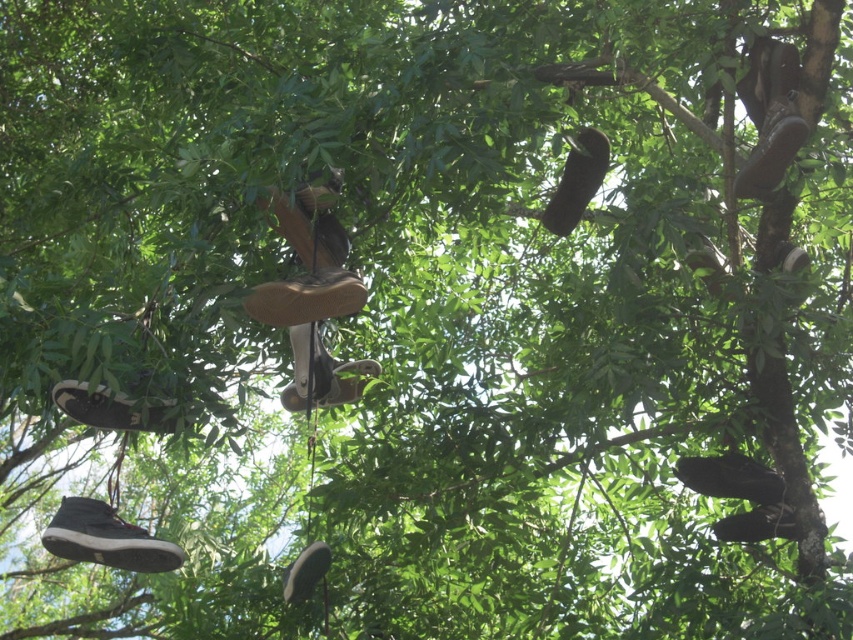
Looking up at the tree with shoes hanging from its branches, you notice a brown suede shoe at center and a leather shoe at center. Which of these two shoes is wider?

The brown suede shoe at center might be wider than the leather shoe at center according to the description.

You are a bird perched on a branch near the black suede shoe at lower left and the matte brown shoe at center. You want to fly from one to the other. Can you make the flight without flapping your wings? The wingspan of a typical bird is about 18 inches.

The distance between the black suede shoe at lower left and the matte brown shoe at center is 27.96 inches. Since the bird has a wingspan of 18 inches, it cannot cover the distance without flapping its wings.